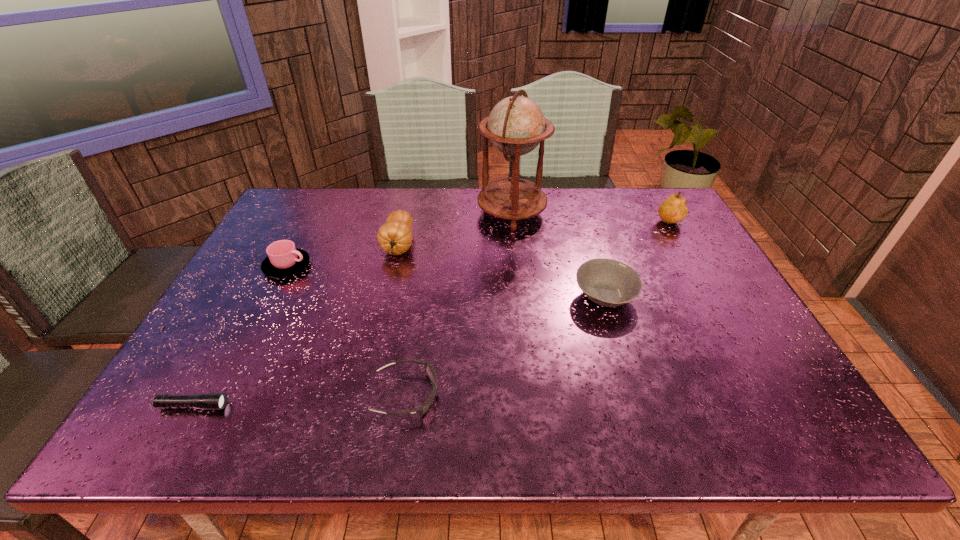
This screenshot has width=960, height=540. What are the coordinates of `vacant point located on the surface of the globe` in the screenshot? It's located at (x=386, y=212).

Identify the location of vacant space located on the left of the rightmost object. (534, 225).

You are a GUI agent. You are given a task and a screenshot of the screen. Output one action in this format:
    pyautogui.click(x=<x>, y=<y>)
    Task: Click on the free point located 0.110m on the stem side of the gourd
    The image size is (960, 540).
    Given the screenshot: What is the action you would take?
    tap(388, 293)

The image size is (960, 540). What are the coordinates of `free point located on the side with the handle of the cup` in the screenshot? It's located at (396, 266).

The image size is (960, 540). I want to click on vacant space located on the front of the bowl, so click(x=638, y=405).

Find the location of `vacant region located 0.310m on the lenses of the goggles`. vacant region located 0.310m on the lenses of the goggles is located at coordinates (588, 395).

What are the coordinates of `free spot located 0.180m at the lens end of the shortest object` in the screenshot? It's located at (314, 406).

Identify the location of globe at the far edge. This screenshot has height=540, width=960. (516, 125).

Locate an element on the screen. pear that is positioned at the far edge is located at coordinates (673, 210).

You are a GUI agent. You are given a task and a screenshot of the screen. Output one action in this format:
    pyautogui.click(x=<x>, y=<y>)
    Task: Click on the gourd at the far edge
    Image resolution: width=960 pixels, height=540 pixels.
    Given the screenshot: What is the action you would take?
    pyautogui.click(x=395, y=237)